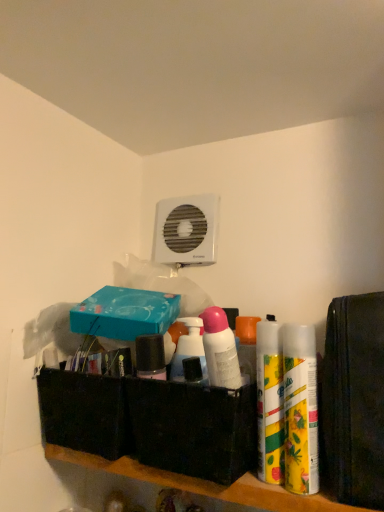
Question: From a real-world perspective, is yellow matte can at right, which is the 2th cleaning product in left-to-right order, on teal matte box at upper center, the 1th box when ordered from top to bottom?

Choices:
 (A) no
 (B) yes

Answer: (A)

Question: Considering the relative positions of yellow matte can at right, acting as the 2th cleaning product starting from the right, and teal matte box at upper center, the 1th box when ordered from top to bottom, in the image provided, is yellow matte can at right, acting as the 2th cleaning product starting from the right, to the right of teal matte box at upper center, the 1th box when ordered from top to bottom, from the viewer's perspective?

Choices:
 (A) no
 (B) yes

Answer: (B)

Question: Is yellow matte can at right, which is the 2th cleaning product in left-to-right order, positioned beyond the bounds of teal matte box at upper center, arranged as the second box when ordered from the bottom?

Choices:
 (A) no
 (B) yes

Answer: (B)

Question: Considering the relative sizes of yellow matte can at right, which is the 2th cleaning product in left-to-right order, and teal matte box at upper center, arranged as the second box when ordered from the bottom, in the image provided, is yellow matte can at right, which is the 2th cleaning product in left-to-right order, shorter than teal matte box at upper center, arranged as the second box when ordered from the bottom,?

Choices:
 (A) yes
 (B) no

Answer: (B)

Question: Can you confirm if yellow matte can at right, which is the 2th cleaning product in left-to-right order, is wider than teal matte box at upper center, the 1th box when ordered from top to bottom?

Choices:
 (A) no
 (B) yes

Answer: (A)

Question: From the image's perspective, relative to black fabric basket at center, which is the 1th box in bottom-to-top order, is teal matte box at upper center, the 1th box when ordered from top to bottom, above or below?

Choices:
 (A) above
 (B) below

Answer: (A)

Question: Relative to black fabric basket at center, marked as the second box in a top-to-bottom arrangement, is teal matte box at upper center, arranged as the second box when ordered from the bottom, in front or behind?

Choices:
 (A) front
 (B) behind

Answer: (B)

Question: Does point (148, 307) appear closer or farther from the camera than point (233, 480)?

Choices:
 (A) closer
 (B) farther

Answer: (B)

Question: Based on their positions, is teal matte box at upper center, the 1th box when ordered from top to bottom, located to the left or right of black fabric basket at center, which is the 1th box in bottom-to-top order?

Choices:
 (A) right
 (B) left

Answer: (B)

Question: From the image's perspective, is yellow matte spray can at right, which ranks as the 3th cleaning product in left-to-right order, above or below black fabric basket at center, which is the 1th box in bottom-to-top order?

Choices:
 (A) below
 (B) above

Answer: (B)

Question: Does point (292, 463) appear closer or farther from the camera than point (203, 468)?

Choices:
 (A) closer
 (B) farther

Answer: (A)

Question: From a real-world perspective, is yellow matte spray can at right, which ranks as the first cleaning product in right-to-left order, physically located above or below black fabric basket at center, which is the 1th box in bottom-to-top order?

Choices:
 (A) above
 (B) below

Answer: (A)

Question: Relative to black fabric basket at center, marked as the second box in a top-to-bottom arrangement, is yellow matte spray can at right, which ranks as the 3th cleaning product in left-to-right order, in front or behind?

Choices:
 (A) front
 (B) behind

Answer: (A)

Question: Does point (278, 468) appear closer or farther from the camera than point (178, 413)?

Choices:
 (A) farther
 (B) closer

Answer: (B)

Question: Considering the positions of yellow matte can at right, which is the 2th cleaning product in left-to-right order, and black fabric basket at center, which is the 1th box in bottom-to-top order, in the image, is yellow matte can at right, which is the 2th cleaning product in left-to-right order, taller or shorter than black fabric basket at center, which is the 1th box in bottom-to-top order,?

Choices:
 (A) short
 (B) tall

Answer: (B)